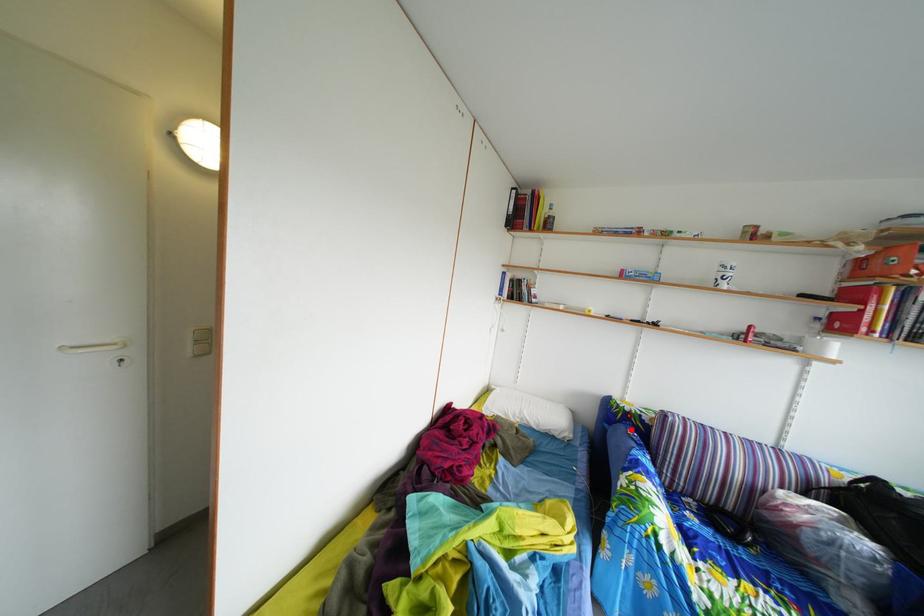
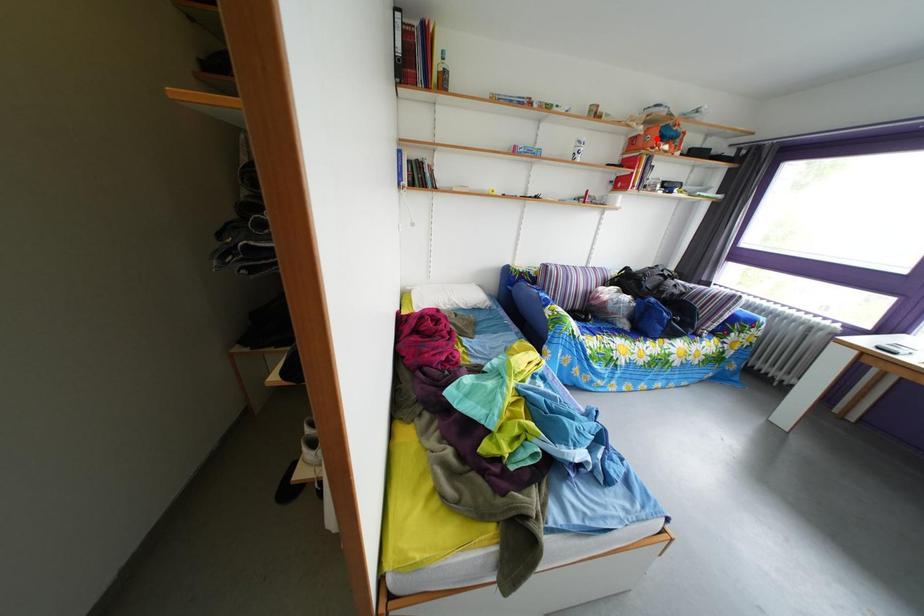
I am providing you with two images of the same scene from different viewpoints. A red point is marked on the first image and another point is marked on the second image. Do the highlighted points in image1 and image2 indicate the same real-world spot?

No